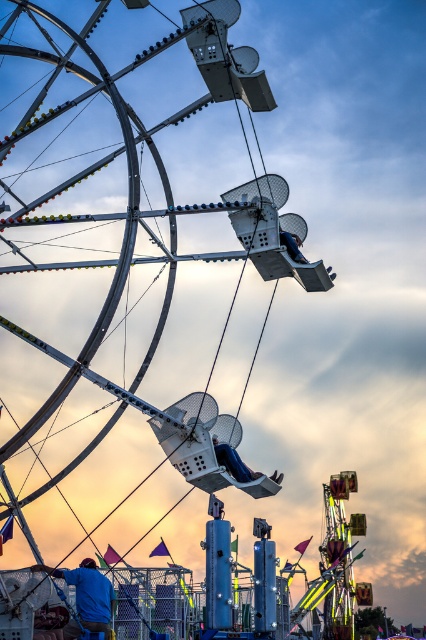
You are a visitor at the fairground and want to sit in the highest blue fabric seat available. Which one should you choose between the blue fabric seat at center and the blue fabric seat at upper center?

The blue fabric seat at center has a greater height compared to the blue fabric seat at upper center, so you should choose the blue fabric seat at center.

You are standing at the base of the Ferris wheel and want to walk towards the two points marked in the image. Which point, point (294, 225) or point (290, 236), will you reach first?

You will reach point (294, 225) first because it is closer to you than point (290, 236), which is further away.